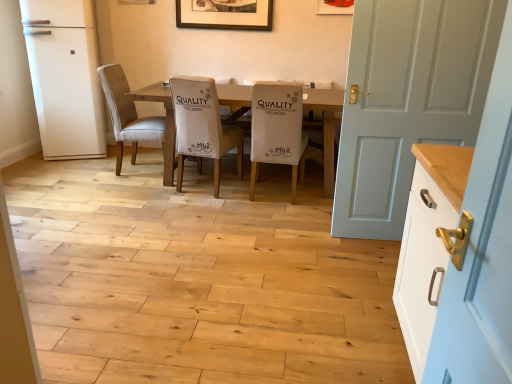
I want to click on free space to the left of white painted wood cabinet at right, so click(x=318, y=346).